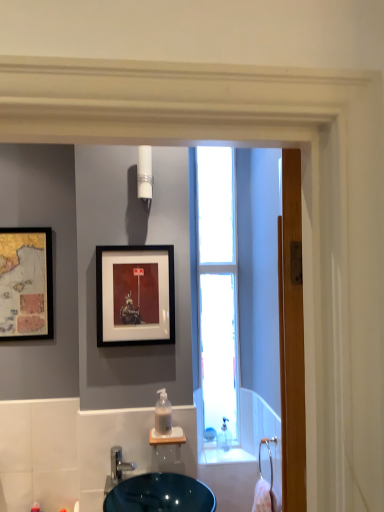
Question: Is matte black picture frame at center, marked as the 1th picture frame in a front-to-back arrangement, closer to the viewer compared to wooden screen door at right?

Choices:
 (A) yes
 (B) no

Answer: (B)

Question: Does matte black picture frame at center, marked as the 1th picture frame in a front-to-back arrangement, appear on the left side of wooden screen door at right?

Choices:
 (A) no
 (B) yes

Answer: (B)

Question: Is matte black picture frame at center, which appears as the second picture frame when viewed from the left, turned away from wooden screen door at right?

Choices:
 (A) yes
 (B) no

Answer: (B)

Question: Is matte black picture frame at center, the second picture frame when ordered from back to front, wider than wooden screen door at right?

Choices:
 (A) yes
 (B) no

Answer: (B)

Question: Is matte black picture frame at center, the second picture frame when ordered from back to front, next to wooden screen door at right and touching it?

Choices:
 (A) no
 (B) yes

Answer: (A)

Question: From a real-world perspective, is white glossy light fixture at upper center positioned above or below clear plastic soap dispenser at center?

Choices:
 (A) below
 (B) above

Answer: (B)

Question: In the image, is white glossy light fixture at upper center positioned in front of or behind clear plastic soap dispenser at center?

Choices:
 (A) behind
 (B) front

Answer: (A)

Question: Does point (142, 162) appear closer or farther from the camera than point (155, 412)?

Choices:
 (A) farther
 (B) closer

Answer: (A)

Question: Is white glossy light fixture at upper center inside the boundaries of clear plastic soap dispenser at center, or outside?

Choices:
 (A) inside
 (B) outside

Answer: (B)

Question: From the image's perspective, is white glossy light fixture at upper center positioned above or below wooden screen door at right?

Choices:
 (A) below
 (B) above

Answer: (B)

Question: Considering the positions of white glossy light fixture at upper center and wooden screen door at right in the image, is white glossy light fixture at upper center taller or shorter than wooden screen door at right?

Choices:
 (A) tall
 (B) short

Answer: (B)

Question: Is white glossy light fixture at upper center situated inside wooden screen door at right or outside?

Choices:
 (A) inside
 (B) outside

Answer: (B)

Question: Visually, is white glossy light fixture at upper center positioned to the left or to the right of wooden screen door at right?

Choices:
 (A) left
 (B) right

Answer: (A)

Question: Would you say transparent glass window at center is inside or outside satin nickel faucet at lower center?

Choices:
 (A) inside
 (B) outside

Answer: (B)

Question: Considering the positions of transparent glass window at center and satin nickel faucet at lower center in the image, is transparent glass window at center bigger or smaller than satin nickel faucet at lower center?

Choices:
 (A) big
 (B) small

Answer: (A)